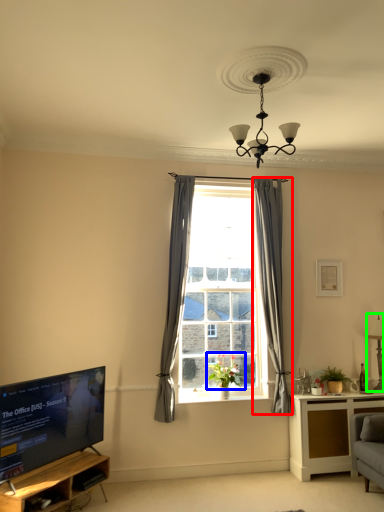
Question: Considering the real-world distances, which object is closest to curtain (highlighted by a red box)? plant (highlighted by a blue box) or lamp (highlighted by a green box).

Choices:
 (A) plant
 (B) lamp

Answer: (A)